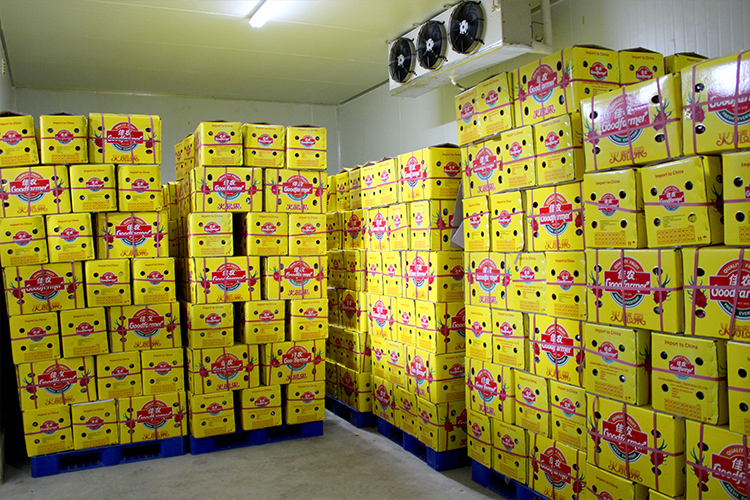
At what (x,y) coordinates should I click in order to perform the action: click on fans. Please return your answer as a coordinate pair (x, y). This screenshot has width=750, height=500. Looking at the image, I should click on (470, 25), (434, 45), (402, 57).